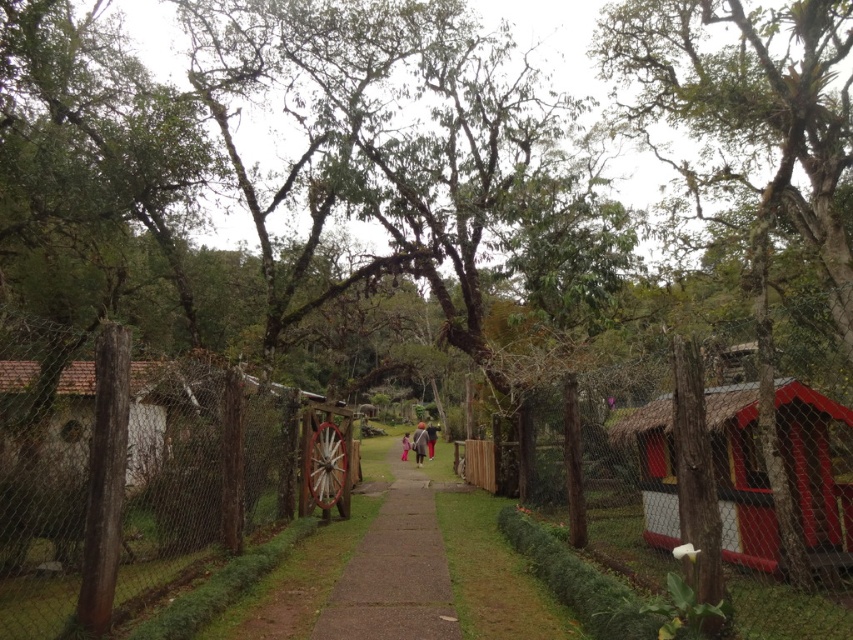
Who is taller, wire mesh fence at center or matte pink coat at center?

wire mesh fence at center is taller.

You are a GUI agent. You are given a task and a screenshot of the screen. Output one action in this format:
    pyautogui.click(x=<x>, y=<y>)
    Task: Click on the wire mesh fence at center
    
    Given the screenshot: What is the action you would take?
    pyautogui.click(x=666, y=490)

Where is `wire mesh fence at center`? This screenshot has height=640, width=853. wire mesh fence at center is located at coordinates (666, 490).

Describe the element at coordinates (815, 470) in the screenshot. The image size is (853, 640). I see `red painted wood hut at right` at that location.

Can you confirm if red painted wood hut at right is positioned to the right of dark gray fabric jacket at center?

Indeed, red painted wood hut at right is positioned on the right side of dark gray fabric jacket at center.

Does point (848, 547) come closer to viewer compared to point (428, 456)?

Yes, it is.

Identify the location of red painted wood hut at right. The image size is (853, 640). 815,470.

Looking at this image, can you confirm if wooden fence at center is taller than light pink fabric at center?

Indeed, wooden fence at center has a greater height compared to light pink fabric at center.

Does point (212, 390) come farther from viewer compared to point (405, 454)?

No, (212, 390) is in front of (405, 454).

The image size is (853, 640). I want to click on wooden fence at center, so click(138, 474).